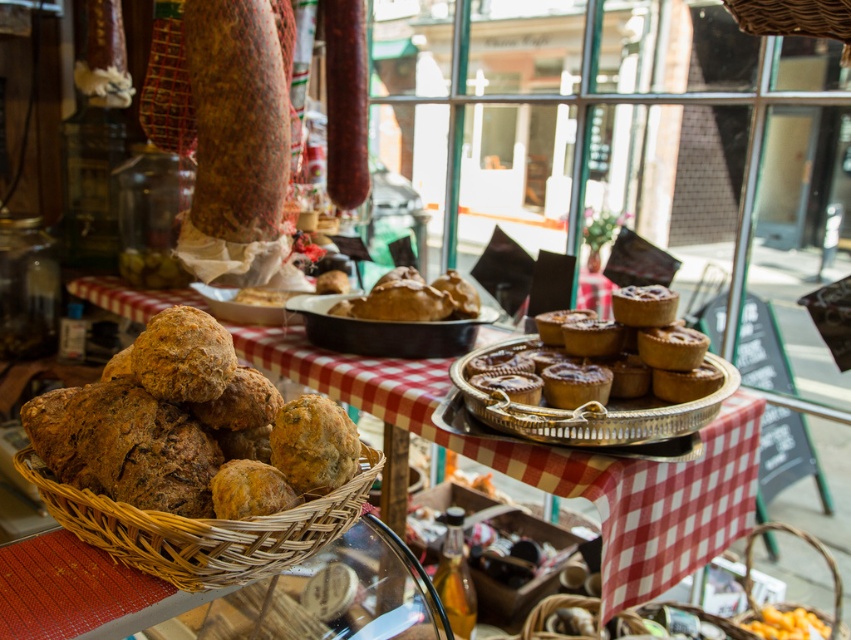
You are a customer at the market and want to choose a basket to carry your pastries. The taller basket might hold more items. Based on the image, which basket should you choose between the woven brown basket at lower left and the woven brown basket at lower right?

The woven brown basket at lower right is taller than the woven brown basket at lower left, so you should choose the woven brown basket at lower right to carry more pastries.

You are a customer at the market and want to know if the golden brown pastry at center can fit inside the woven brown basket at lower right without needing to be rearranged. Can you determine this based on their sizes?

The golden brown pastry at center has a lesser height compared to the woven brown basket at lower right, so it can fit inside without needing to be rearranged.